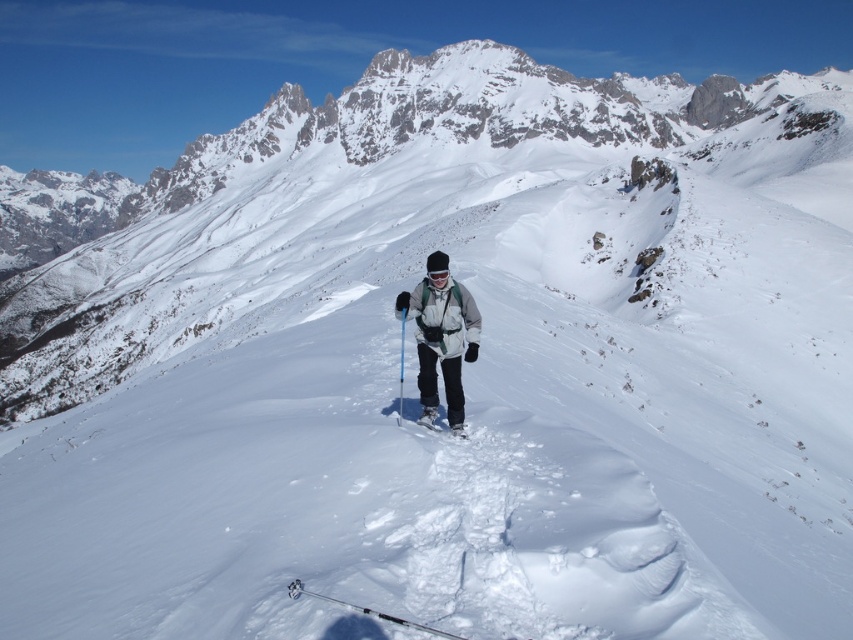
Question: Does matte gray jacket at center have a lesser width compared to white matte ski at center?

Choices:
 (A) no
 (B) yes

Answer: (A)

Question: Which point appears closest to the camera in this image?

Choices:
 (A) (459, 435)
 (B) (375, 614)

Answer: (B)

Question: Can you confirm if black plastic ski pole at lower center is positioned to the right of white matte ski at center?

Choices:
 (A) no
 (B) yes

Answer: (A)

Question: Which of these objects is positioned farthest from the matte black ski pole at center?

Choices:
 (A) matte gray jacket at center
 (B) white matte ski at center

Answer: (B)

Question: Which point is closer to the camera taking this photo?

Choices:
 (A) (462, 436)
 (B) (456, 282)
 (C) (401, 364)
 (D) (419, 624)

Answer: (D)

Question: Can you confirm if black plastic ski pole at lower center is positioned to the right of white matte ski at center?

Choices:
 (A) no
 (B) yes

Answer: (A)